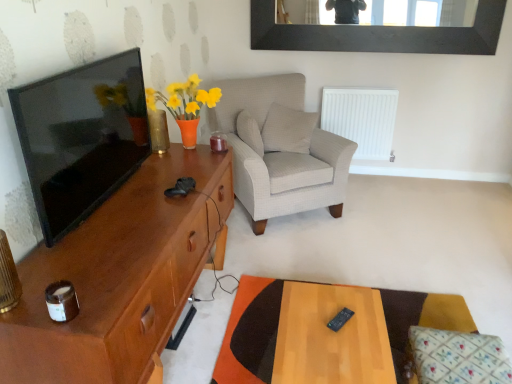
Question: From a real-world perspective, is black plastic remote at center under white plastic radiator at center right?

Choices:
 (A) yes
 (B) no

Answer: (A)

Question: From the image's perspective, does black plastic remote at center appear higher than white plastic radiator at center right?

Choices:
 (A) yes
 (B) no

Answer: (B)

Question: Is black plastic remote at center smaller than white plastic radiator at center right?

Choices:
 (A) yes
 (B) no

Answer: (A)

Question: Is black plastic remote at center oriented away from white plastic radiator at center right?

Choices:
 (A) no
 (B) yes

Answer: (A)

Question: Is black plastic remote at center further to the viewer compared to white plastic radiator at center right?

Choices:
 (A) no
 (B) yes

Answer: (A)

Question: Considering the positions of floral fabric cushion at lower right, the 1th pillow in the right-to-left sequence, and wooden table at lower right in the image, is floral fabric cushion at lower right, the 1th pillow in the right-to-left sequence, bigger or smaller than wooden table at lower right?

Choices:
 (A) small
 (B) big

Answer: (A)

Question: Relative to wooden table at lower right, is floral fabric cushion at lower right, marked as the third pillow in a top-to-bottom arrangement, in front or behind?

Choices:
 (A) front
 (B) behind

Answer: (A)

Question: In the image, is floral fabric cushion at lower right, marked as the third pillow in a top-to-bottom arrangement, on the left side or the right side of wooden table at lower right?

Choices:
 (A) left
 (B) right

Answer: (B)

Question: Considering the positions of point (445, 339) and point (474, 324), is point (445, 339) closer or farther from the camera than point (474, 324)?

Choices:
 (A) closer
 (B) farther

Answer: (A)

Question: Looking at their shapes, would you say black matte picture frame at upper center is wider or thinner than white textured pillow at center, positioned as the 1th pillow in left-to-right order?

Choices:
 (A) wide
 (B) thin

Answer: (B)

Question: Does point (303, 39) appear closer or farther from the camera than point (249, 140)?

Choices:
 (A) closer
 (B) farther

Answer: (B)

Question: Visually, is black matte picture frame at upper center positioned to the left or to the right of white textured pillow at center, which ranks as the third pillow in right-to-left order?

Choices:
 (A) left
 (B) right

Answer: (B)

Question: Considering their positions, is black matte picture frame at upper center located in front of or behind white textured pillow at center, which is counted as the 2th pillow, starting from the bottom?

Choices:
 (A) behind
 (B) front

Answer: (A)

Question: Is brown wood cabinet at left spatially inside white plastic radiator at center right, or outside of it?

Choices:
 (A) outside
 (B) inside

Answer: (A)

Question: Does point (121, 226) appear closer or farther from the camera than point (367, 110)?

Choices:
 (A) farther
 (B) closer

Answer: (B)